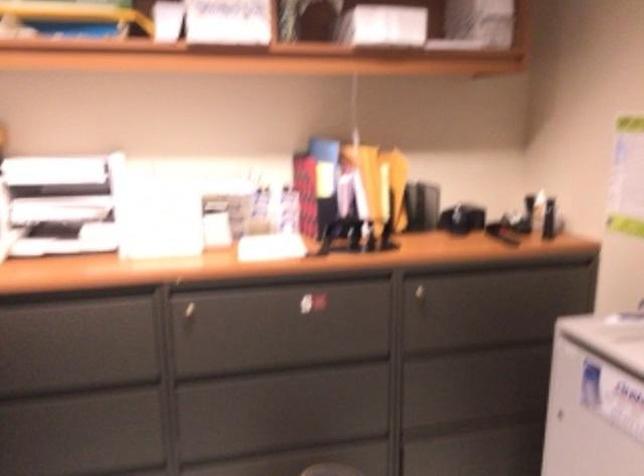
Locate an element on the screen. drawer keyhole is located at coordinates (185, 307).